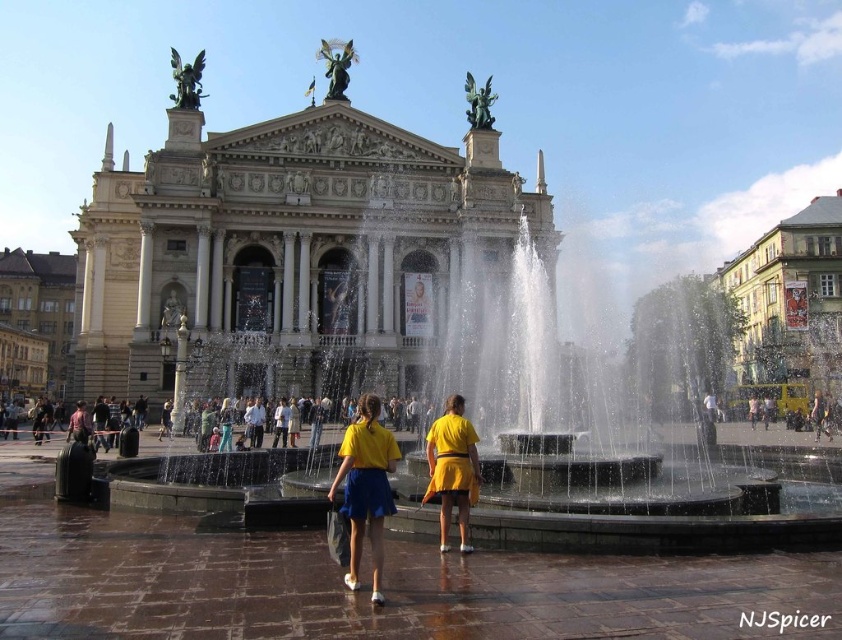
Is yellow matte skirt at center smaller than yellow matte shorts at center?

No.

Where is `yellow matte skirt at center`? The height and width of the screenshot is (640, 842). yellow matte skirt at center is located at coordinates (366, 486).